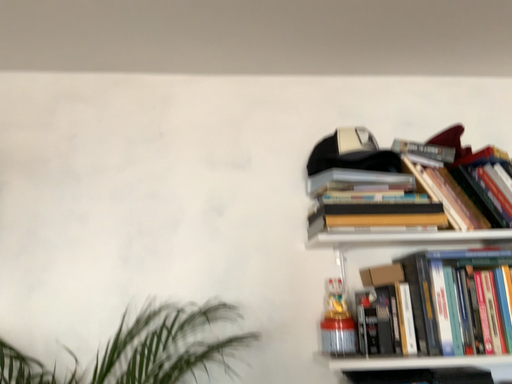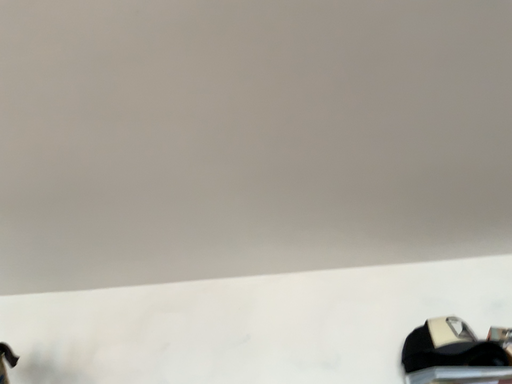
Question: How did the camera likely rotate when shooting the video?

Choices:
 (A) rotated right
 (B) rotated left

Answer: (B)